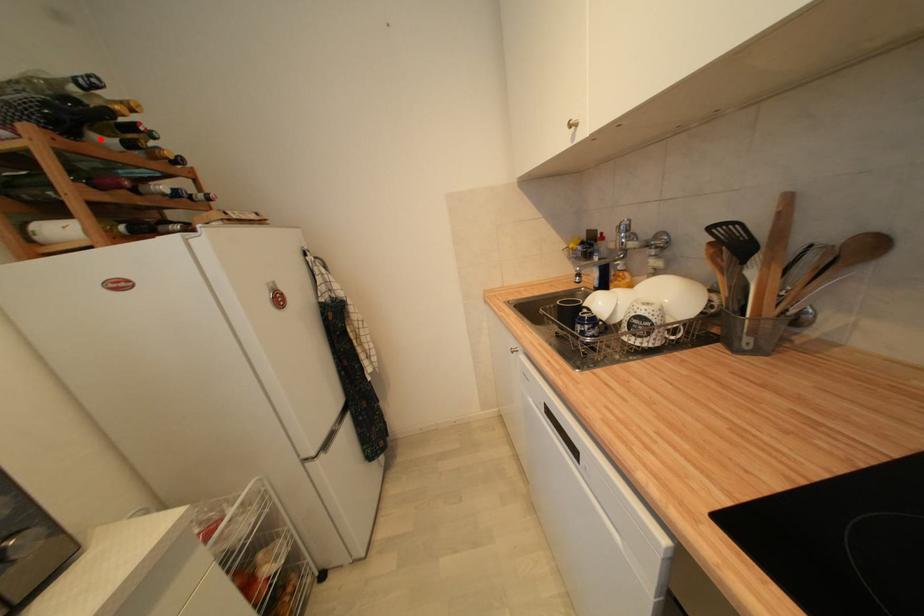
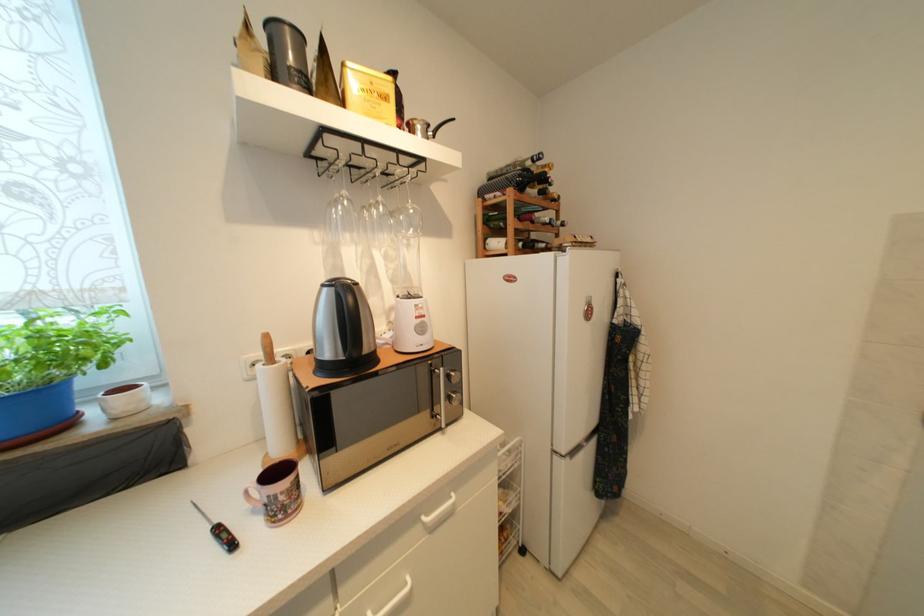
Question: I am providing you with two images of the same scene from different viewpoints. Given a red point in image1, look at the same physical point in image2. Is it:

Choices:
 (A) Closer to the viewpoint
 (B) Farther from the viewpoint

Answer: (A)